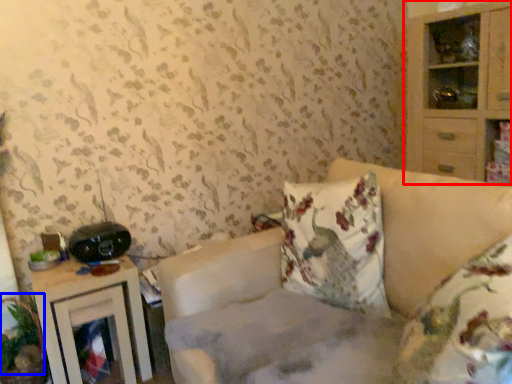
Question: Which object is closer to the camera taking this photo, cabinetry (highlighted by a red box) or plant (highlighted by a blue box)?

Choices:
 (A) cabinetry
 (B) plant

Answer: (B)